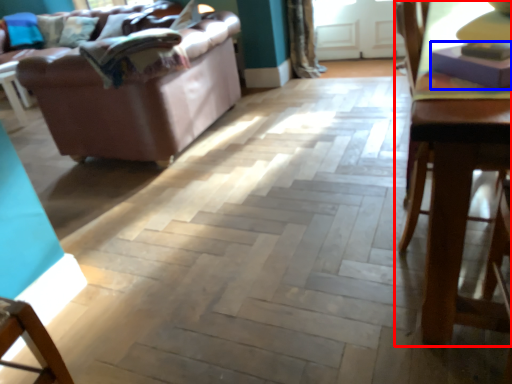
Question: Which object appears farthest to the camera in this image, table (highlighted by a red box) or book (highlighted by a blue box)?

Choices:
 (A) table
 (B) book

Answer: (B)